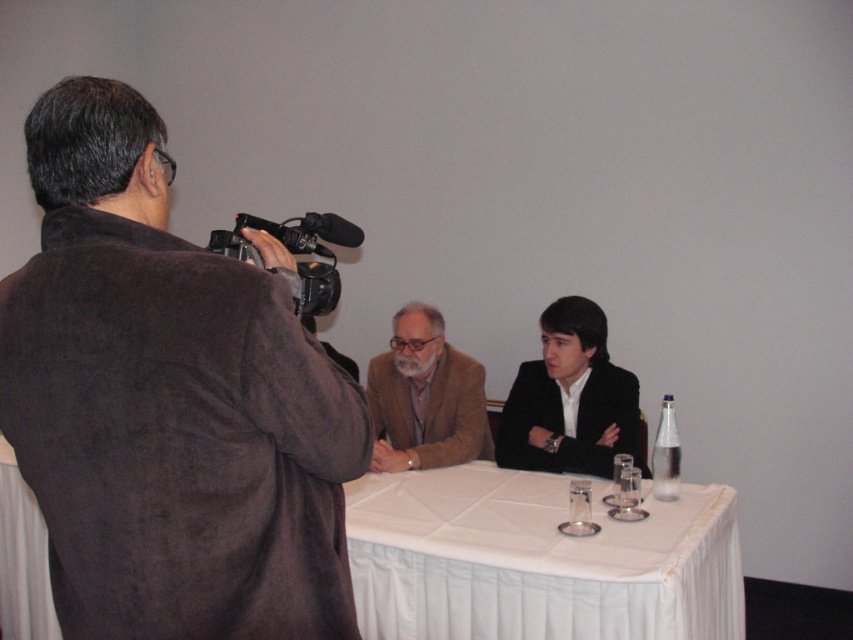
Question: Which point appears closest to the camera in this image?

Choices:
 (A) (654, 625)
 (B) (526, 413)
 (C) (107, 614)

Answer: (C)

Question: Observing the image, what is the correct spatial positioning of black matte business suit at center in reference to clear glass bottle at right?

Choices:
 (A) right
 (B) left

Answer: (B)

Question: Which point appears farthest from the camera in this image?

Choices:
 (A) (670, 460)
 (B) (375, 396)

Answer: (B)

Question: Is brown woolen suit at center bigger than clear glass bottle at right?

Choices:
 (A) no
 (B) yes

Answer: (B)

Question: Which point is closer to the camera?

Choices:
 (A) black matte business suit at center
 (B) clear glass bottle at right
 (C) black plastic video camera at upper left
 (D) white cloth-covered table at center

Answer: (C)

Question: Does brown suede jacket at left have a greater width compared to white cloth-covered table at center?

Choices:
 (A) no
 (B) yes

Answer: (A)